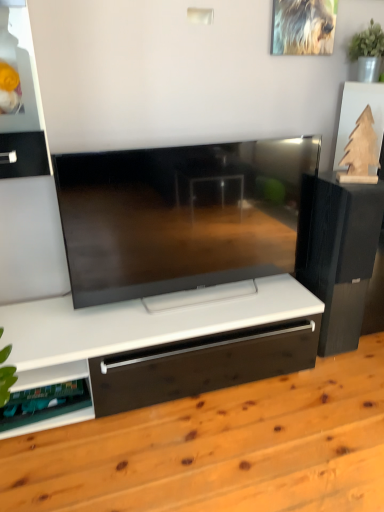
I want to click on empty space that is ontop of green plastic shelf at lower left (from a real-world perspective), so click(38, 399).